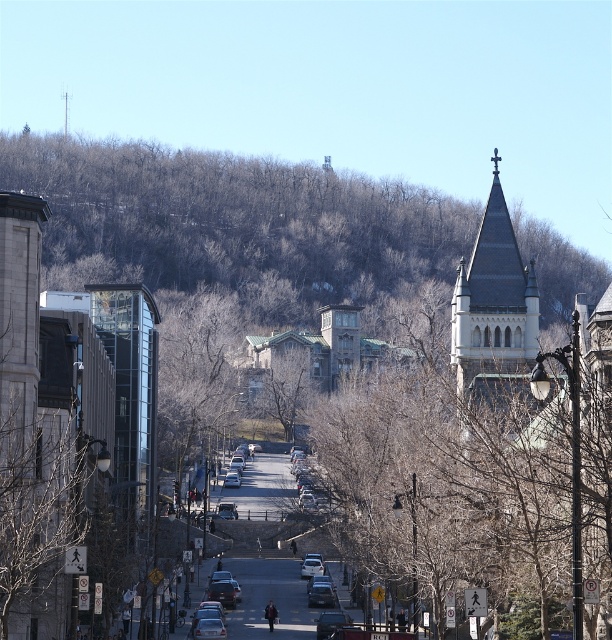
You are standing on the street looking towards the hillside. There are two points marked in the image. The first point is at coordinates point (x=401, y=528) and the second point is at point (x=248, y=380). Which of these two points is closer to you?

Point (x=401, y=528) is closer to the viewer than point (x=248, y=380).

You are a bird looking for a place to perch. You see the bare branches at center and the brown leafless tree at center. Which one is taller and would provide a higher vantage point?

The bare branches at center is taller than the brown leafless tree at center, so it would provide a higher vantage point.

You are a delivery drone with a wingspan of 3.5 feet. You need to fly from the modern building on the left to the historic tower on the right. There are bare branches at left and a brown leafless tree at center in your path. Can you safely navigate between them without hitting any obstacles?

The distance between the bare branches at left and the brown leafless tree at center is 430.08 feet. Since your wingspan is only 3.5 feet, there is more than enough space to safely navigate between them without any collision risks.